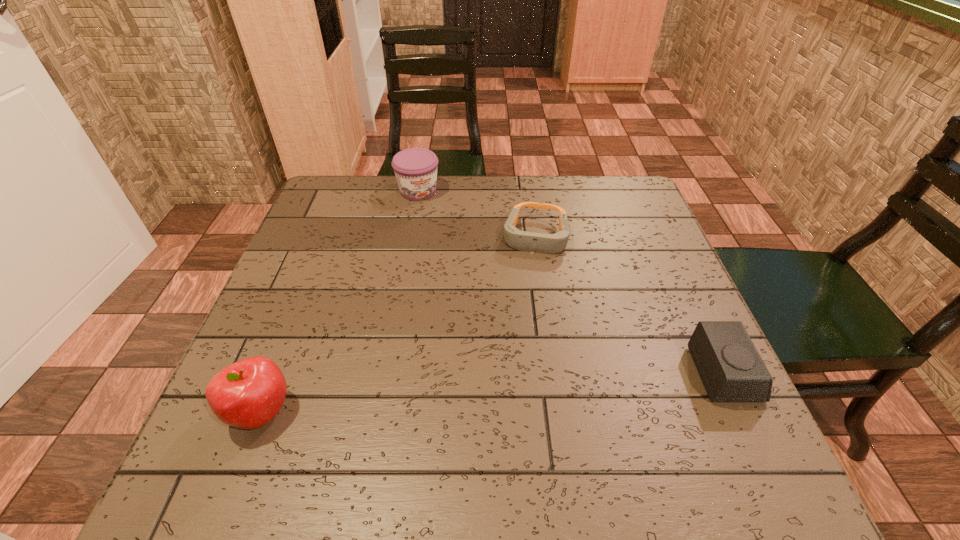
Image resolution: width=960 pixels, height=540 pixels. What are the coordinates of `free spot located on the front and back of the goggles` in the screenshot? It's located at [x=528, y=288].

The width and height of the screenshot is (960, 540). Identify the location of free space located 0.080m on the front and back of the goggles. (528, 285).

Locate an element on the screen. free space located 0.370m on the front label of the second object from left to right is located at coordinates (478, 292).

Find the location of a particular element. This screenshot has width=960, height=540. free space located on the front label of the second object from left to right is located at coordinates (454, 251).

In order to click on free space located on the front label of the second object from left to right in this screenshot , I will do `click(442, 230)`.

Identify the location of goggles at the far edge. (521, 240).

In order to click on jam present at the far edge in this screenshot , I will do `click(415, 169)`.

Locate an element on the screen. apple positioned at the near edge is located at coordinates (249, 393).

What are the coordinates of `alarm clock situated at the near edge` in the screenshot? It's located at (731, 369).

This screenshot has width=960, height=540. In order to click on object at the left edge in this screenshot , I will do (x=249, y=393).